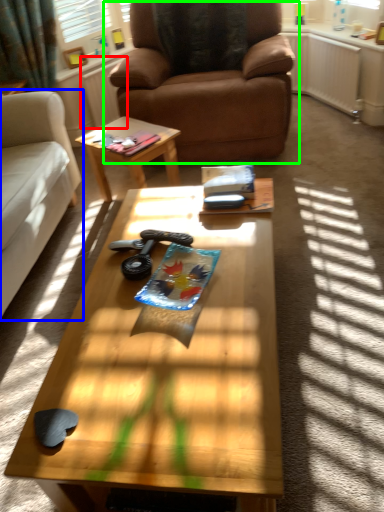
Question: Based on their relative distances, which object is nearer to radiator (highlighted by a red box)? Choose from studio couch (highlighted by a blue box) and chair (highlighted by a green box).

Choices:
 (A) studio couch
 (B) chair

Answer: (B)